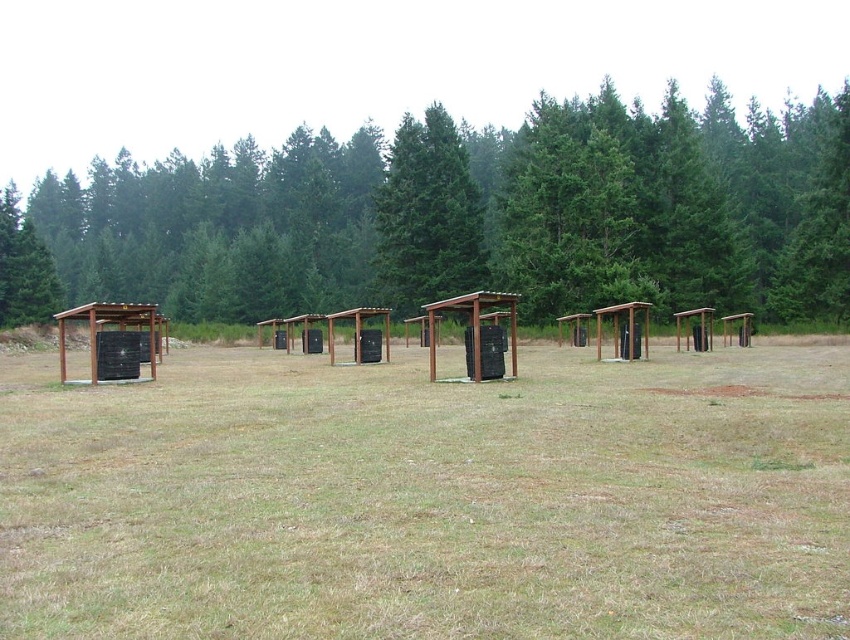
Question: Does green matte tree at center lie behind brown wooden shelter at center?

Choices:
 (A) yes
 (B) no

Answer: (A)

Question: Which point is closer to the camera taking this photo?

Choices:
 (A) (54, 317)
 (B) (479, 372)
 (C) (463, 196)
 (D) (752, 452)

Answer: (D)

Question: Based on their relative distances, which object is nearer to the green textured trees at upper center?

Choices:
 (A) green matte tree at center
 (B) brown wooden shelter at center

Answer: (A)

Question: Is brown dry grass at center bigger than brown wooden shelter at center?

Choices:
 (A) no
 (B) yes

Answer: (B)

Question: Is brown dry grass at center behind green matte tree at center?

Choices:
 (A) yes
 (B) no

Answer: (B)

Question: Among these points, which one is nearest to the camera?

Choices:
 (A) (599, 280)
 (B) (476, 360)
 (C) (89, 362)

Answer: (B)